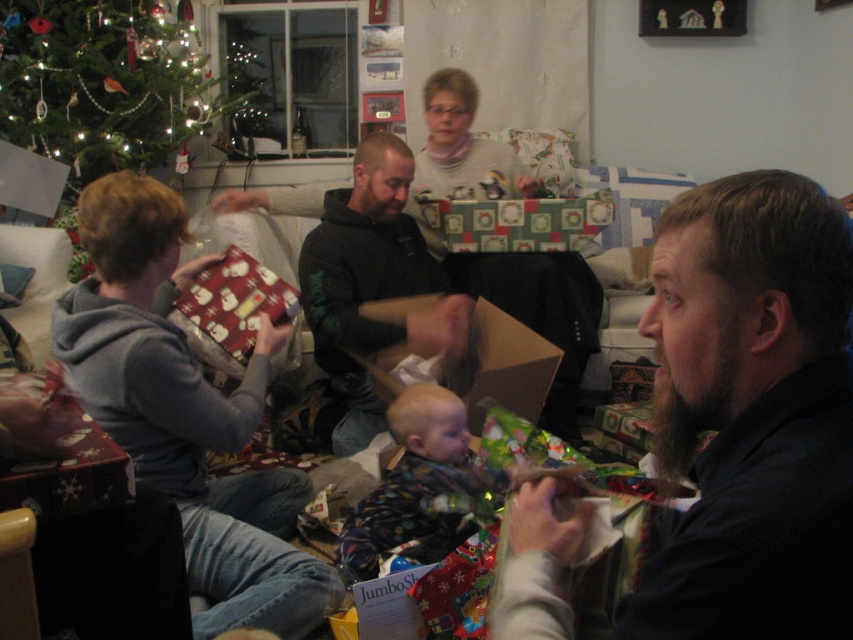
Is green matte christmas tree at upper left further to camera compared to printed fabric baby at center?

That is True.

Which is below, green matte christmas tree at upper left or printed fabric baby at center?

printed fabric baby at center

Which is behind, point (62, 193) or point (387, 518)?

The point (62, 193) is behind.

Identify the location of green matte christmas tree at upper left. This screenshot has width=853, height=640. (102, 88).

Is point (740, 186) farther from camera compared to point (161, 321)?

No, (740, 186) is in front of (161, 321).

Does dark brown leather jacket at center have a larger size compared to matte gray hoodie at left?

No, dark brown leather jacket at center is not bigger than matte gray hoodie at left.

Between point (788, 236) and point (151, 333), which one is positioned in front?

Point (788, 236) is more forward.

Identify the location of dark brown leather jacket at center. (751, 413).

Is point (828, 620) positioned before point (378, 147)?

Yes, it is in front of point (378, 147).

This screenshot has width=853, height=640. Find the location of `dark brown leather jacket at center`. dark brown leather jacket at center is located at coordinates tap(751, 413).

Which is in front, point (701, 376) or point (392, 156)?

Point (701, 376)

Find the location of `dark brown leather jacket at center`. dark brown leather jacket at center is located at coordinates (751, 413).